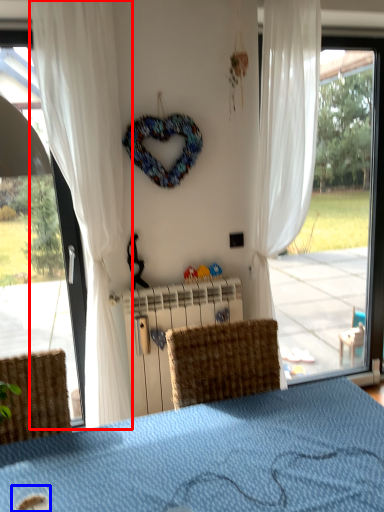
Question: Which object is closer to the camera taking this photo, curtain (highlighted by a red box) or beverage (highlighted by a blue box)?

Choices:
 (A) curtain
 (B) beverage

Answer: (B)